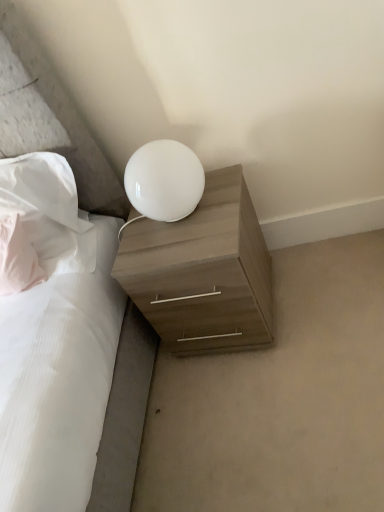
Locate an element on the screen. The width and height of the screenshot is (384, 512). vacant region to the left of white glossy lamp at upper center is located at coordinates (133, 245).